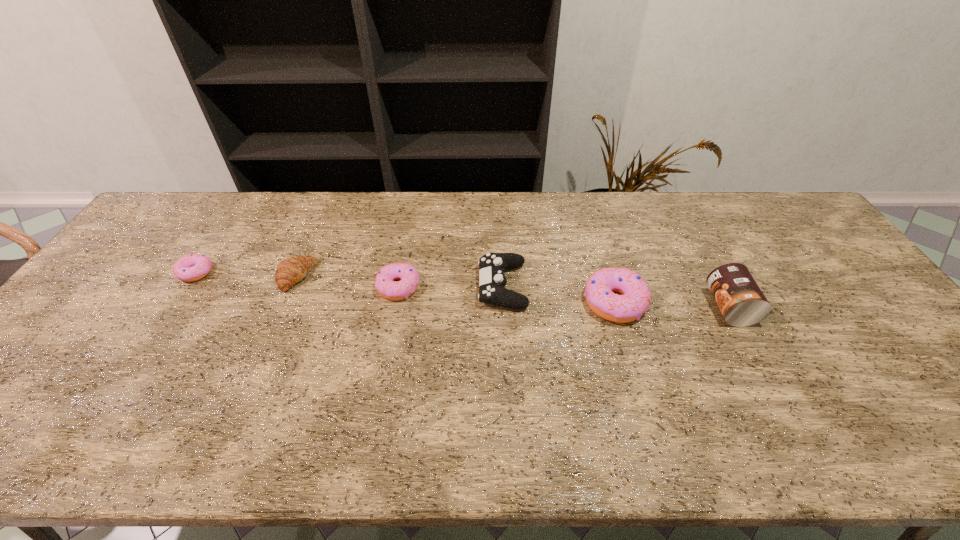
Locate an element on the screen. This screenshot has width=960, height=540. free space at the far edge is located at coordinates (395, 202).

Image resolution: width=960 pixels, height=540 pixels. Find the location of `vacant space at the near edge of the desktop`. vacant space at the near edge of the desktop is located at coordinates (163, 390).

You are a GUI agent. You are given a task and a screenshot of the screen. Output one action in this format:
    pyautogui.click(x=<x>, y=<y>)
    Task: Click on the vacant space at the right edge of the desktop
    The image size is (960, 540).
    Given the screenshot: What is the action you would take?
    pyautogui.click(x=874, y=350)

Where is `vacant region at the far left corner of the desktop`? vacant region at the far left corner of the desktop is located at coordinates (185, 205).

Locate an element on the screen. Image resolution: width=960 pixels, height=540 pixels. free area in between the second tallest doughnut and the fourth object from left to right is located at coordinates (450, 286).

Locate an element on the screen. vacant area that lies between the control and the second shortest doughnut is located at coordinates (450, 286).

Identify the location of vacant space that is in between the second shortest doughnut and the can. (564, 297).

Identify the location of free point between the tallest doughnut and the tallest object. The height and width of the screenshot is (540, 960). (672, 305).

Image resolution: width=960 pixels, height=540 pixels. In order to click on free space between the third object from right to left and the shortest doughnut in this screenshot , I will do `click(348, 279)`.

The image size is (960, 540). I want to click on object that is the third nearest to the tallest object, so click(387, 287).